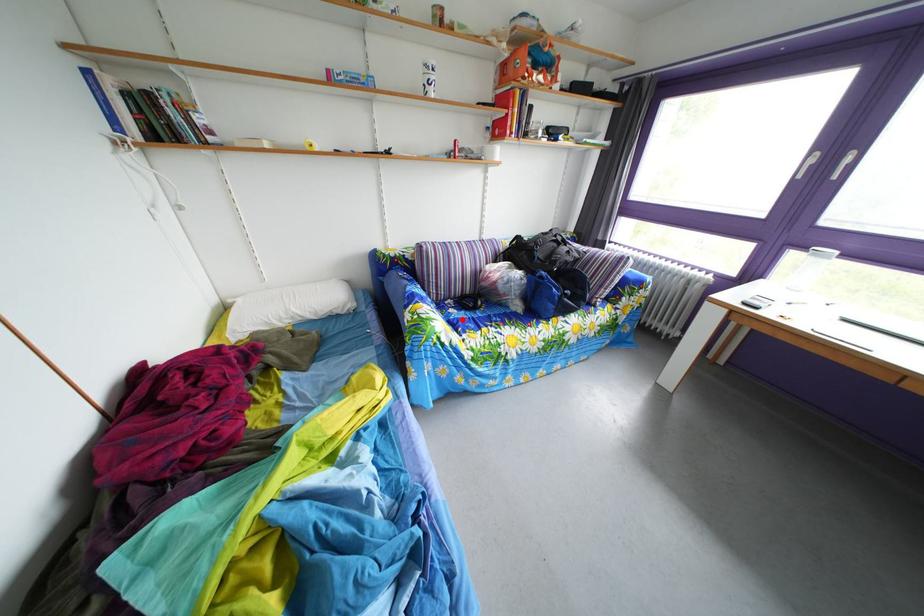
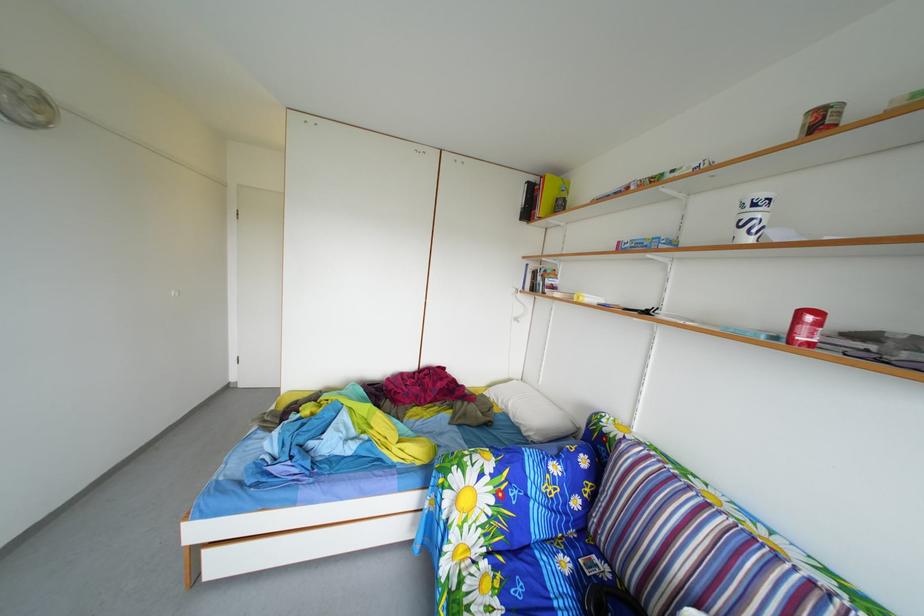
In the second image, find the point that corresponds to the highlighted location in the first image.

(576, 570)